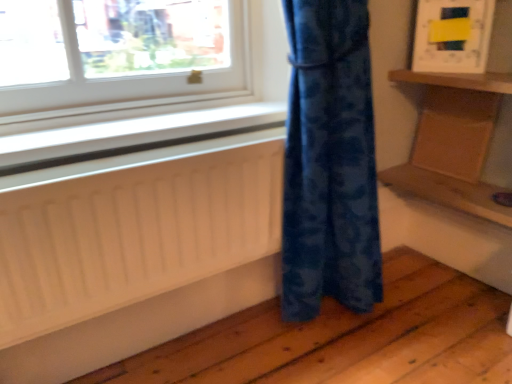
Question: Is wooden tray at right positioned in front of wooden at right, the second shelf in the top-to-bottom sequence?

Choices:
 (A) no
 (B) yes

Answer: (A)

Question: Is wooden at right, the first shelf when ordered from bottom to top, at the back of wooden tray at right?

Choices:
 (A) yes
 (B) no

Answer: (B)

Question: Can you confirm if wooden tray at right is positioned to the right of wooden at right, the first shelf when ordered from bottom to top?

Choices:
 (A) no
 (B) yes

Answer: (B)

Question: Is wooden tray at right smaller than wooden at right, the second shelf in the top-to-bottom sequence?

Choices:
 (A) yes
 (B) no

Answer: (A)

Question: Are wooden tray at right and wooden at right, the second shelf in the top-to-bottom sequence, making contact?

Choices:
 (A) no
 (B) yes

Answer: (A)

Question: Is wooden at right, the second shelf in the top-to-bottom sequence, situated inside white matte radiator at lower left or outside?

Choices:
 (A) outside
 (B) inside

Answer: (A)

Question: Based on their sizes in the image, would you say wooden at right, the first shelf when ordered from bottom to top, is bigger or smaller than white matte radiator at lower left?

Choices:
 (A) big
 (B) small

Answer: (B)

Question: Relative to white matte radiator at lower left, is wooden at right, the second shelf in the top-to-bottom sequence, in front or behind?

Choices:
 (A) front
 (B) behind

Answer: (B)

Question: Is wooden at right, the first shelf when ordered from bottom to top, wider or thinner than white matte radiator at lower left?

Choices:
 (A) thin
 (B) wide

Answer: (B)

Question: Based on their positions, is wooden at right, the first shelf when ordered from bottom to top, located to the left or right of wooden shelf at upper right, acting as the first shelf starting from the top?

Choices:
 (A) right
 (B) left

Answer: (A)

Question: Based on their sizes in the image, would you say wooden at right, the first shelf when ordered from bottom to top, is bigger or smaller than wooden shelf at upper right, the second shelf from the bottom?

Choices:
 (A) small
 (B) big

Answer: (A)

Question: In terms of width, does wooden at right, the first shelf when ordered from bottom to top, look wider or thinner when compared to wooden shelf at upper right, the second shelf from the bottom?

Choices:
 (A) wide
 (B) thin

Answer: (A)

Question: In terms of height, does wooden at right, the first shelf when ordered from bottom to top, look taller or shorter compared to wooden shelf at upper right, the second shelf from the bottom?

Choices:
 (A) short
 (B) tall

Answer: (A)

Question: Do you think white matte radiator at lower left is within wooden at right, the first shelf when ordered from bottom to top, or outside of it?

Choices:
 (A) inside
 (B) outside

Answer: (B)

Question: From the image's perspective, is white matte radiator at lower left positioned above or below wooden at right, the second shelf in the top-to-bottom sequence?

Choices:
 (A) above
 (B) below

Answer: (B)